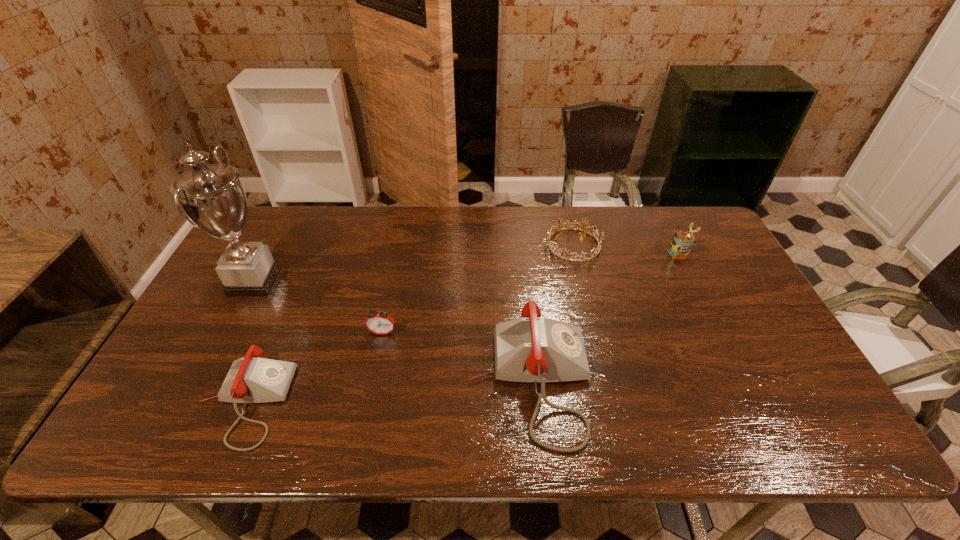
Locate an element on the screen. This screenshot has width=960, height=540. object situated at the near left corner is located at coordinates (252, 379).

This screenshot has width=960, height=540. Find the location of `object situated at the far right corner`. object situated at the far right corner is located at coordinates (682, 242).

Image resolution: width=960 pixels, height=540 pixels. I want to click on vacant area at the far edge, so click(363, 229).

Where is `vacant space at the near edge of the desktop`? Image resolution: width=960 pixels, height=540 pixels. vacant space at the near edge of the desktop is located at coordinates (473, 402).

The image size is (960, 540). Find the location of `vacant space at the left edge of the desktop`. vacant space at the left edge of the desktop is located at coordinates (244, 300).

You are a GUI agent. You are given a task and a screenshot of the screen. Output one action in this format:
    pyautogui.click(x=<x>, y=<y>)
    Task: Click on the vacant space at the right edge
    
    Given the screenshot: What is the action you would take?
    pyautogui.click(x=737, y=351)

At what (x,y) coordinates should I click in order to perform the action: click on vacant point at the far left corner. Please return your answer as a coordinate pair (x, y). The width and height of the screenshot is (960, 540). Looking at the image, I should click on (291, 231).

The width and height of the screenshot is (960, 540). I want to click on vacant space at the far right corner of the desktop, so click(x=708, y=229).

At what (x,y) coordinates should I click in order to perform the action: click on free space between the rightmost object and the shorter telephone. Please return your answer as a coordinate pair (x, y). Looking at the image, I should click on (461, 328).

Find the location of a particular element. Image resolution: width=960 pixels, height=540 pixels. free space that is in between the shortest object and the fifth tallest object is located at coordinates (409, 323).